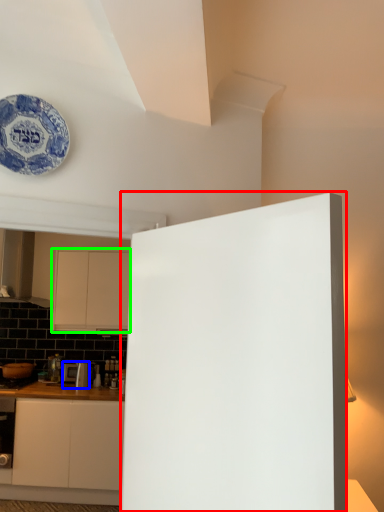
Question: Estimate the real-world distances between objects in this image. Which object is farther from door (highlighted by a red box), appliance (highlighted by a blue box) or cabinetry (highlighted by a green box)?

Choices:
 (A) appliance
 (B) cabinetry

Answer: (A)